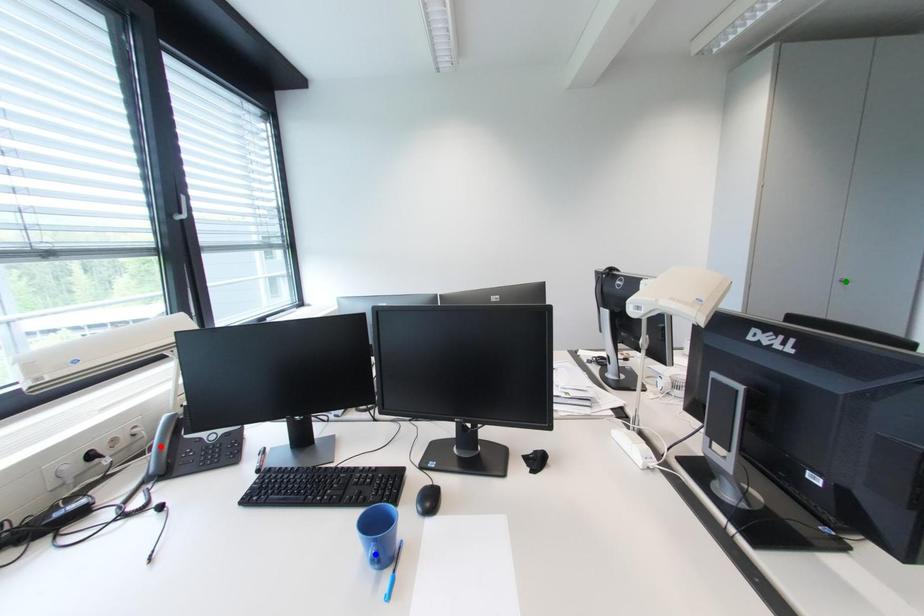
Order these from farthest to nearest:
1. blue point
2. green point
3. red point

green point, red point, blue point